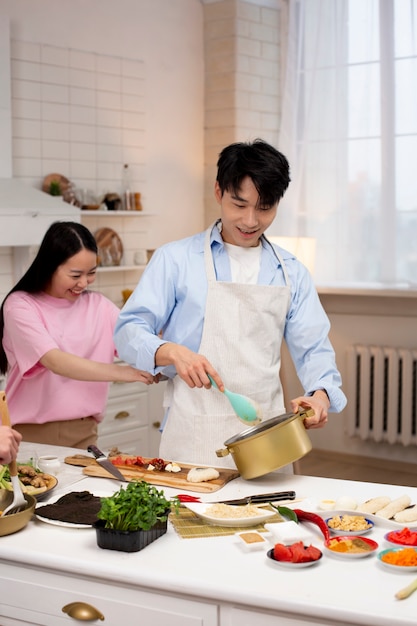
The width and height of the screenshot is (417, 626). What are the coordinates of `curtains` in the screenshot? It's located at (337, 133), (385, 193).